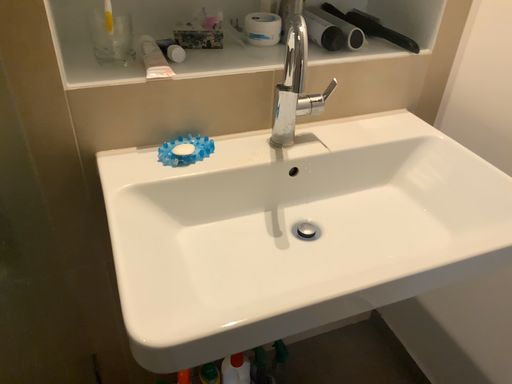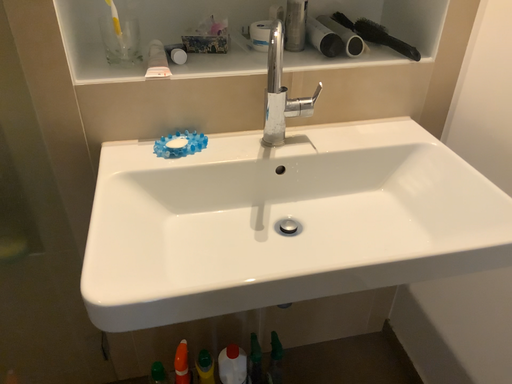
Question: How did the camera likely rotate when shooting the video?

Choices:
 (A) rotated left
 (B) rotated right

Answer: (A)